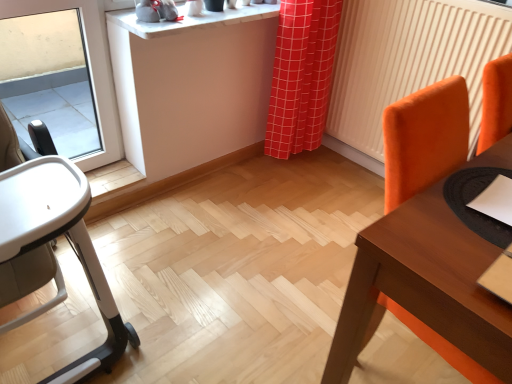
Identify the location of free area in between beige fabric highchair at left and orange fabric radiator at right. (246, 232).